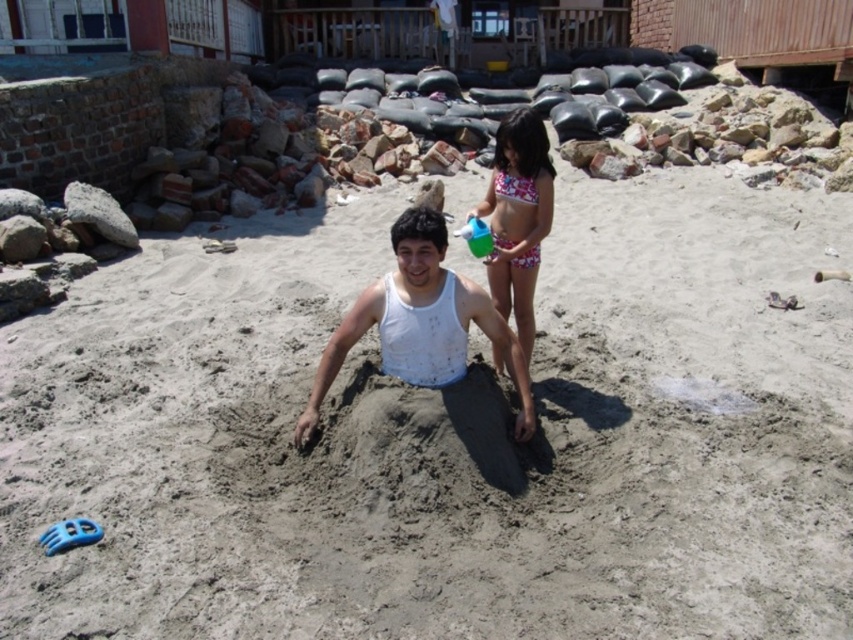
You are a photographer trying to capture a candid shot of the white matte tank top at center and the pink floral swimsuit at upper center. To ensure both are visible in the frame, which object should you focus on first?

The white matte tank top at center is in front of the pink floral swimsuit at upper center, so you should focus on the white matte tank top at center first to ensure both are in clear view.

From the picture: You are a photographer trying to capture the scene of the gray sandy beach at center and the white matte tank top at center. Which object should you focus on first if you want to ensure both are in the same frame without moving the camera?

The gray sandy beach at center is not as tall as the white matte tank top at center, so you should focus on the white matte tank top at center first to ensure both fit within the frame.